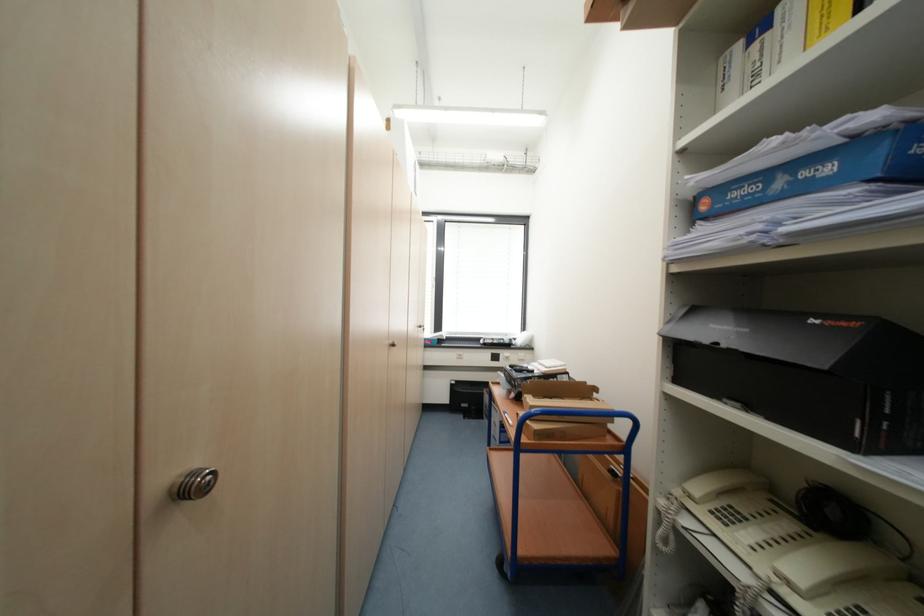
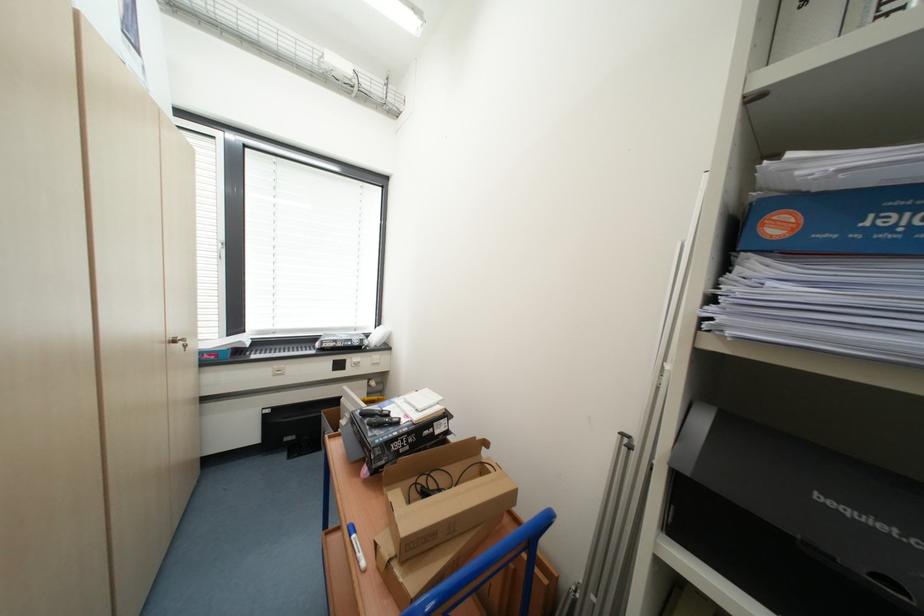
Question: How did the camera likely rotate?

Choices:
 (A) Left
 (B) Right
 (C) Up
 (D) Down

Answer: (B)